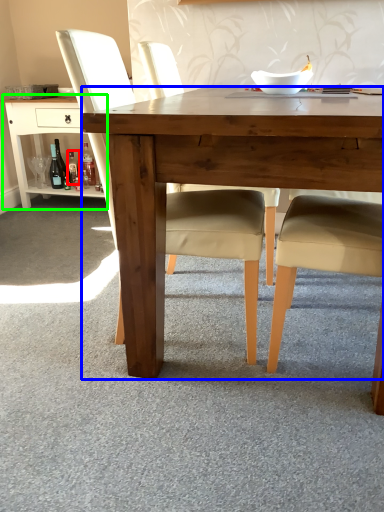
Question: Which object is the closest to the bottle (highlighted by a red box)? Choose among these: desk (highlighted by a blue box) or table (highlighted by a green box).

Choices:
 (A) desk
 (B) table

Answer: (B)